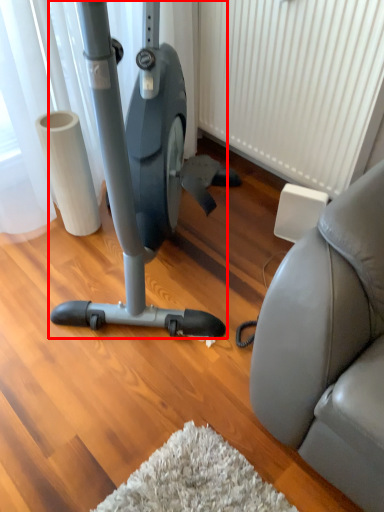
Question: From the image's perspective, where is stationary bicycle (annotated by the red box) located in relation to radiator in the image?

Choices:
 (A) below
 (B) above

Answer: (A)